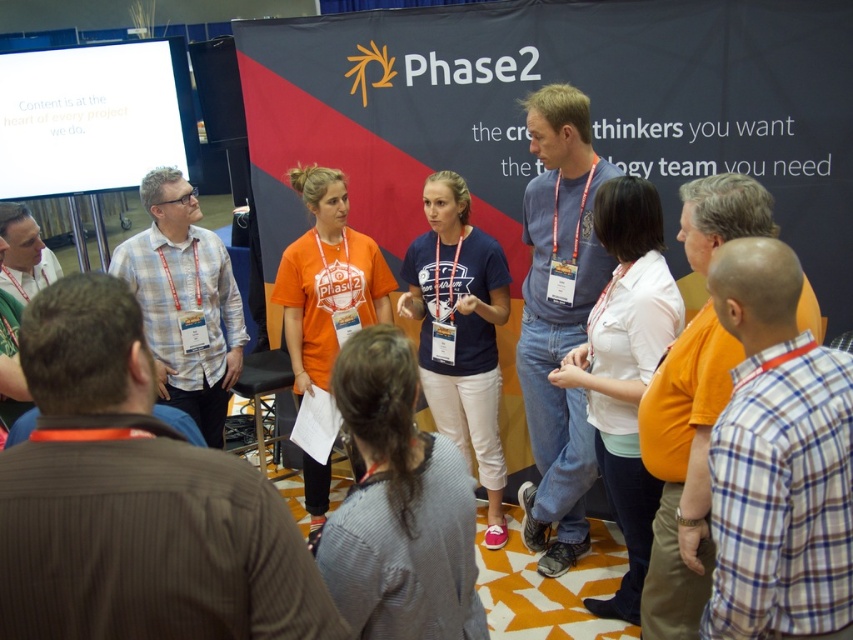
Can you confirm if blue denim jeans at center is bigger than orange shirt at right?

Yes.

Based on the photo, between blue denim jeans at center and orange shirt at right, which one has more height?

blue denim jeans at center

Is point (546, 429) closer to camera compared to point (683, 198)?

That is False.

Where is `blue denim jeans at center`? The image size is (853, 640). blue denim jeans at center is located at coordinates (558, 320).

Is point (100, 476) positioned after point (537, 188)?

No.

Who is more forward, (288, 525) or (573, 532)?

Point (288, 525) is in front.

Is point (183, 636) positioned before point (592, 248)?

Yes, it is in front of point (592, 248).

Locate an element on the screen. brown pinstripe shirt at center is located at coordinates (135, 500).

Which of these two, brown pinstripe shirt at center or white checkered shirt at center, stands taller?

With more height is white checkered shirt at center.

Is brown pinstripe shirt at center to the right of white checkered shirt at center from the viewer's perspective?

Yes, brown pinstripe shirt at center is to the right of white checkered shirt at center.

Measure the distance between brown pinstripe shirt at center and camera.

brown pinstripe shirt at center is 38.86 inches from camera.

You are a GUI agent. You are given a task and a screenshot of the screen. Output one action in this format:
    pyautogui.click(x=<x>, y=<y>)
    Task: Click on the brown pinstripe shirt at center
    
    Given the screenshot: What is the action you would take?
    pyautogui.click(x=135, y=500)